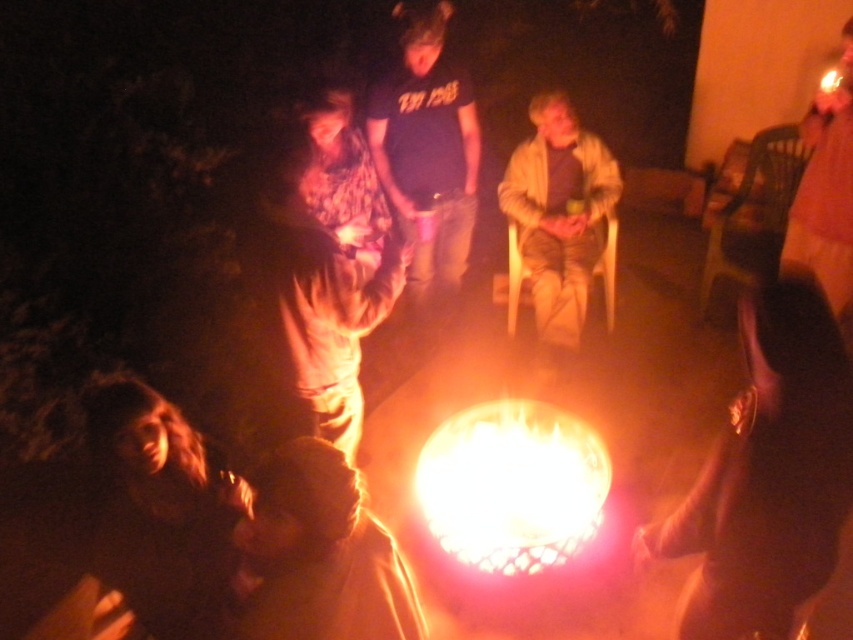
Is fluffy beige pants at center thinner than dark blue t-shirt at center?

Incorrect, fluffy beige pants at center's width is not less than dark blue t-shirt at center's.

This screenshot has width=853, height=640. What do you see at coordinates (325, 298) in the screenshot?
I see `fluffy beige pants at center` at bounding box center [325, 298].

Where is `fluffy beige pants at center`? The image size is (853, 640). fluffy beige pants at center is located at coordinates (325, 298).

Is flamematerial/texture at center thinner than dark blue t-shirt at center?

Incorrect, flamematerial/texture at center's width is not less than dark blue t-shirt at center's.

Does flamematerial/texture at center have a smaller size compared to dark blue t-shirt at center?

Yes.

Is point (519, 445) more distant than point (454, 70)?

No.

Locate an element on the screen. flamematerial/texture at center is located at coordinates (512, 484).

You are a GUI agent. You are given a task and a screenshot of the screen. Output one action in this format:
    pyautogui.click(x=<x>, y=<y>)
    Task: Click on the light brown fabric jacket at center
    The height and width of the screenshot is (640, 853).
    Given the screenshot: What is the action you would take?
    pyautogui.click(x=558, y=216)

Does light brown fabric jacket at center appear on the left side of pink fabric at right?

Correct, you'll find light brown fabric jacket at center to the left of pink fabric at right.

Does point (598, 220) lie behind point (825, 192)?

Yes, point (598, 220) is behind point (825, 192).

Where is `light brown fabric jacket at center`? The height and width of the screenshot is (640, 853). light brown fabric jacket at center is located at coordinates (558, 216).